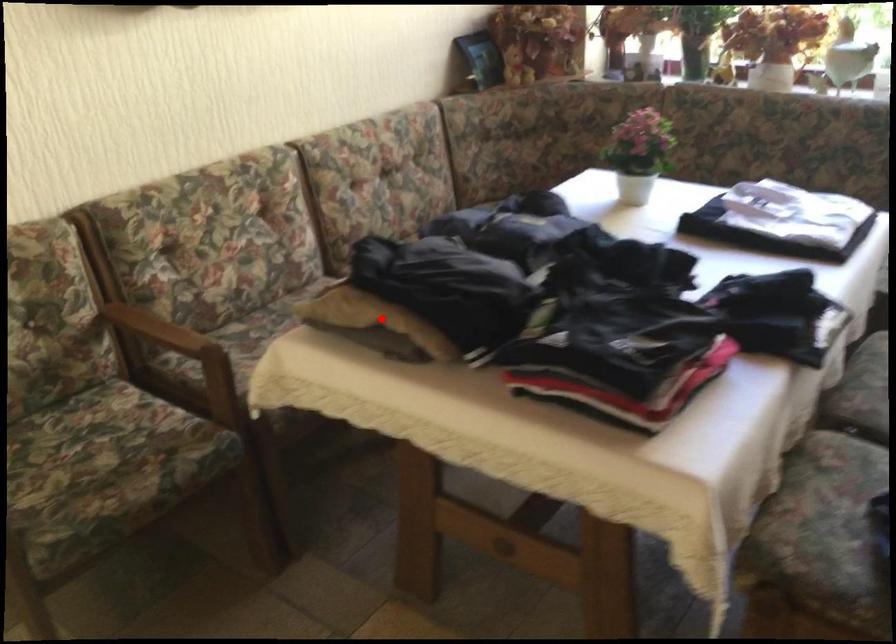
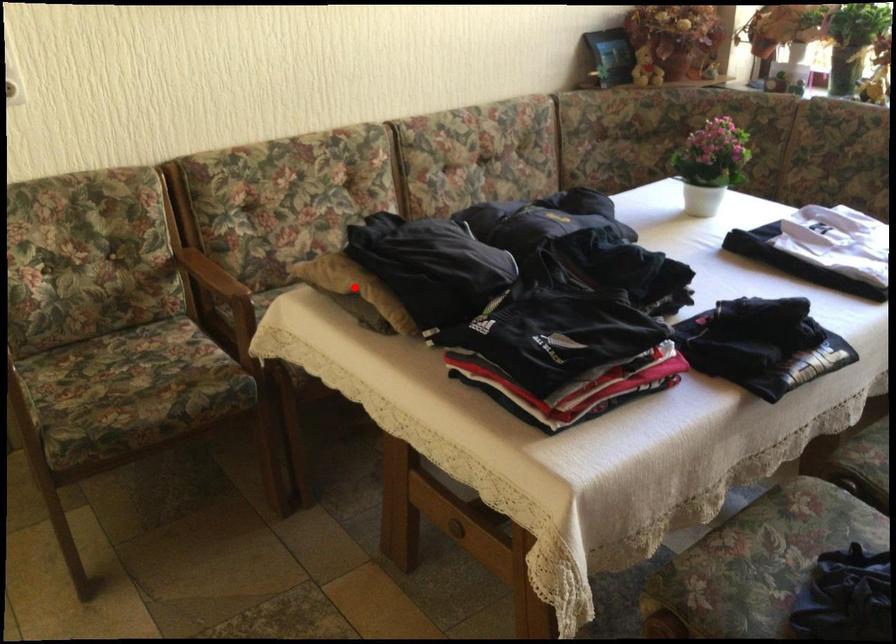
I am providing you with two images of the same scene from different viewpoints. A red point is marked on the first image and another point is marked on the second image. Are the points marked in image1 and image2 representing the same 3D position?

Yes